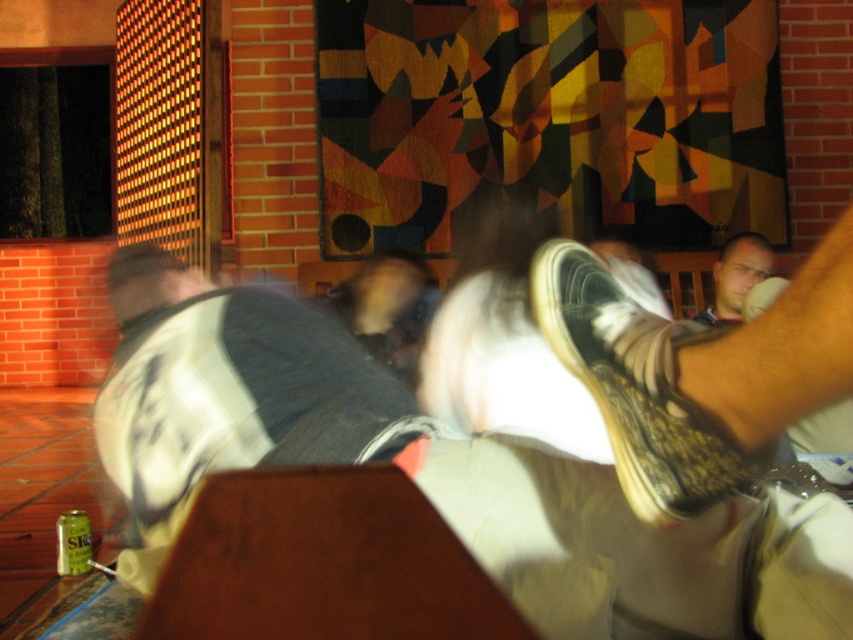
Which is in front, point (672, 504) or point (726, 280)?

Point (672, 504)

I want to click on worn leather shoe at lower right, so click(636, 388).

Does white cotton shirt at upper center have a greater height compared to smooth skin face at upper right?

Yes, white cotton shirt at upper center is taller than smooth skin face at upper right.

From the picture: Can you confirm if white cotton shirt at upper center is positioned above smooth skin face at upper right?

Incorrect, white cotton shirt at upper center is not positioned above smooth skin face at upper right.

You are a GUI agent. You are given a task and a screenshot of the screen. Output one action in this format:
    pyautogui.click(x=<x>, y=<y>)
    Task: Click on the white cotton shirt at upper center
    
    Given the screenshot: What is the action you would take?
    pyautogui.click(x=438, y=474)

Does point (846, 525) come closer to viewer compared to point (619, 388)?

No.

Consider the image. Is white cotton shirt at upper center bigger than worn leather shoe at lower right?

Yes.

Find the location of a particular element. white cotton shirt at upper center is located at coordinates (438, 474).

I want to click on white cotton shirt at upper center, so click(438, 474).